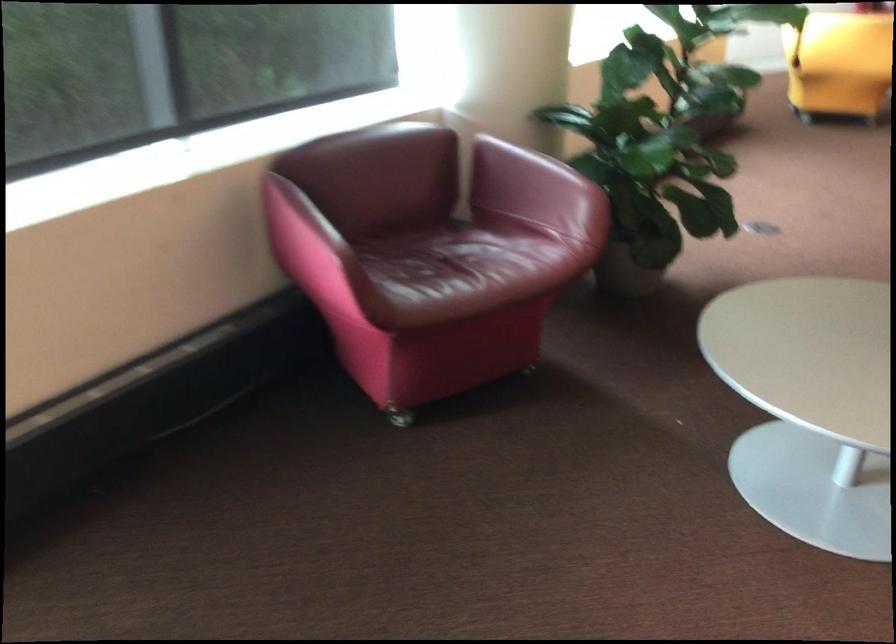
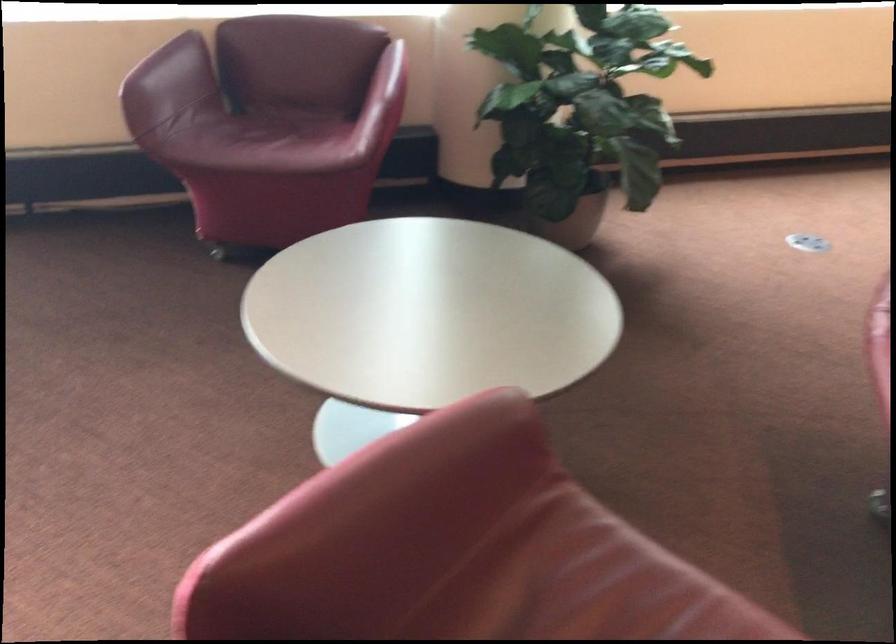
Locate, in the second image, the point that corresponds to point 607,190 in the first image.

(385, 100)